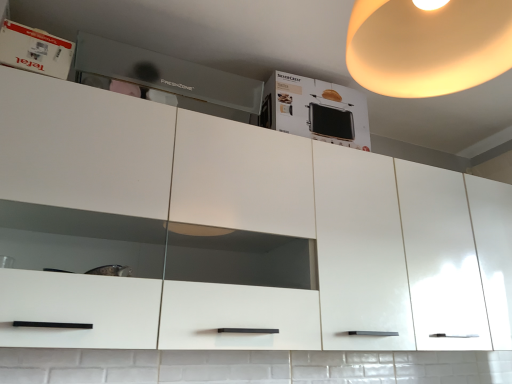
Question: From the image's perspective, does warm matte lampshade at upper right appear higher than white cardboard box at upper center?

Choices:
 (A) yes
 (B) no

Answer: (A)

Question: Does warm matte lampshade at upper right have a larger size compared to white cardboard box at upper center?

Choices:
 (A) no
 (B) yes

Answer: (B)

Question: Is warm matte lampshade at upper right at the left side of white cardboard box at upper center?

Choices:
 (A) yes
 (B) no

Answer: (B)

Question: Is warm matte lampshade at upper right not inside white cardboard box at upper center?

Choices:
 (A) no
 (B) yes

Answer: (B)

Question: Is warm matte lampshade at upper right smaller than white cardboard box at upper center?

Choices:
 (A) no
 (B) yes

Answer: (A)

Question: From the image's perspective, is matte gray drawer at upper center located above or below white glossy box at upper left?

Choices:
 (A) above
 (B) below

Answer: (B)

Question: From a real-world perspective, is matte gray drawer at upper center physically located above or below white glossy box at upper left?

Choices:
 (A) above
 (B) below

Answer: (A)

Question: Considering their positions, is matte gray drawer at upper center located in front of or behind white glossy box at upper left?

Choices:
 (A) behind
 (B) front

Answer: (A)

Question: Considering the positions of point (106, 41) and point (45, 61), is point (106, 41) closer or farther from the camera than point (45, 61)?

Choices:
 (A) closer
 (B) farther

Answer: (B)

Question: Is white cardboard box at upper center to the left or to the right of matte gray drawer at upper center in the image?

Choices:
 (A) left
 (B) right

Answer: (B)

Question: Looking at their shapes, would you say white cardboard box at upper center is wider or thinner than matte gray drawer at upper center?

Choices:
 (A) wide
 (B) thin

Answer: (A)

Question: Does point (337, 117) appear closer or farther from the camera than point (97, 62)?

Choices:
 (A) farther
 (B) closer

Answer: (A)

Question: Is white cardboard box at upper center in front of or behind matte gray drawer at upper center in the image?

Choices:
 (A) front
 (B) behind

Answer: (B)

Question: Considering the positions of warm matte lampshade at upper right and white glossy box at upper left in the image, is warm matte lampshade at upper right taller or shorter than white glossy box at upper left?

Choices:
 (A) tall
 (B) short

Answer: (A)

Question: Visually, is warm matte lampshade at upper right positioned to the left or to the right of white glossy box at upper left?

Choices:
 (A) left
 (B) right

Answer: (B)